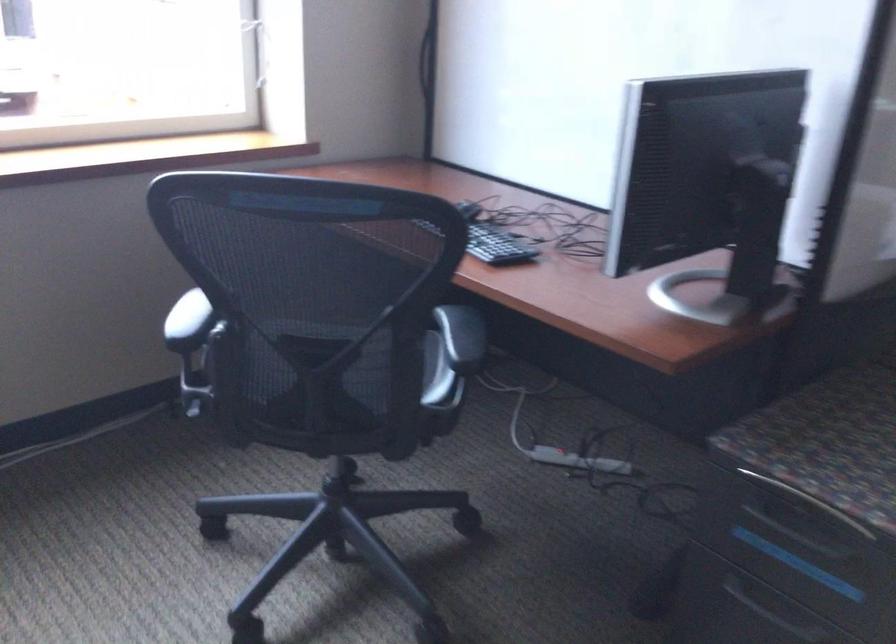
At what (x,y) coordinates should I click in order to perform the action: click on black keyboard. Please return your answer as a coordinate pair (x, y). This screenshot has height=644, width=896. Looking at the image, I should click on (489, 243).